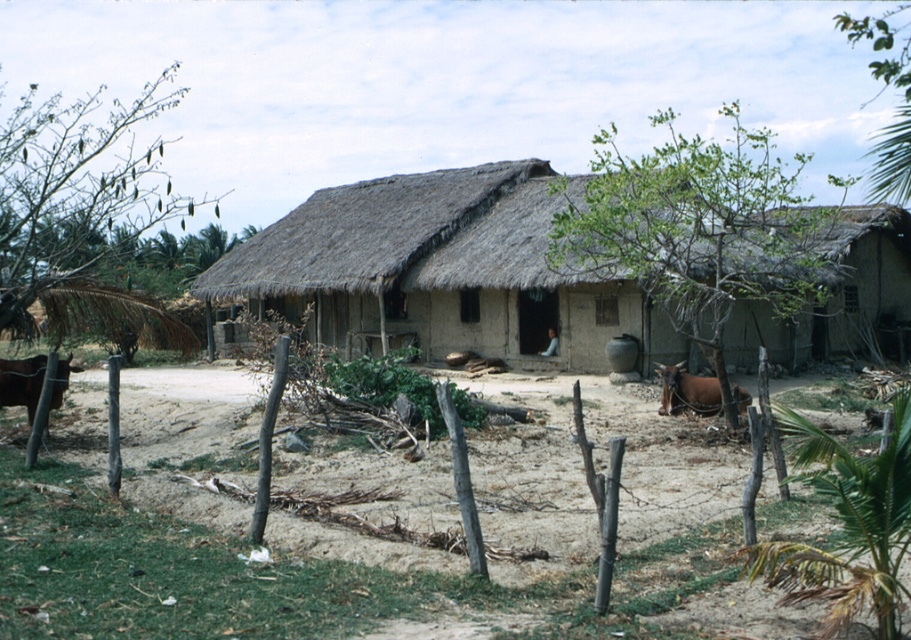
Question: Which of the following is the farthest from the observer?

Choices:
 (A) brown leather cow at left
 (B) brown leather cow at center
 (C) brown dirt field at center
 (D) thatched roof hut at center

Answer: (D)

Question: Is thatched roof hut at center to the right of brown leather cow at left from the viewer's perspective?

Choices:
 (A) yes
 (B) no

Answer: (A)

Question: Is brown leather cow at center positioned in front of brown leather cow at left?

Choices:
 (A) no
 (B) yes

Answer: (A)

Question: Among these objects, which one is farthest from the camera?

Choices:
 (A) thatched roof hut at center
 (B) brown leather cow at left
 (C) brown dirt field at center
 (D) brown leather cow at center

Answer: (A)

Question: Which object is closer to the camera taking this photo?

Choices:
 (A) thatched roof hut at center
 (B) brown leather cow at center

Answer: (B)

Question: Does thatched roof hut at center appear over brown leather cow at center?

Choices:
 (A) yes
 (B) no

Answer: (A)